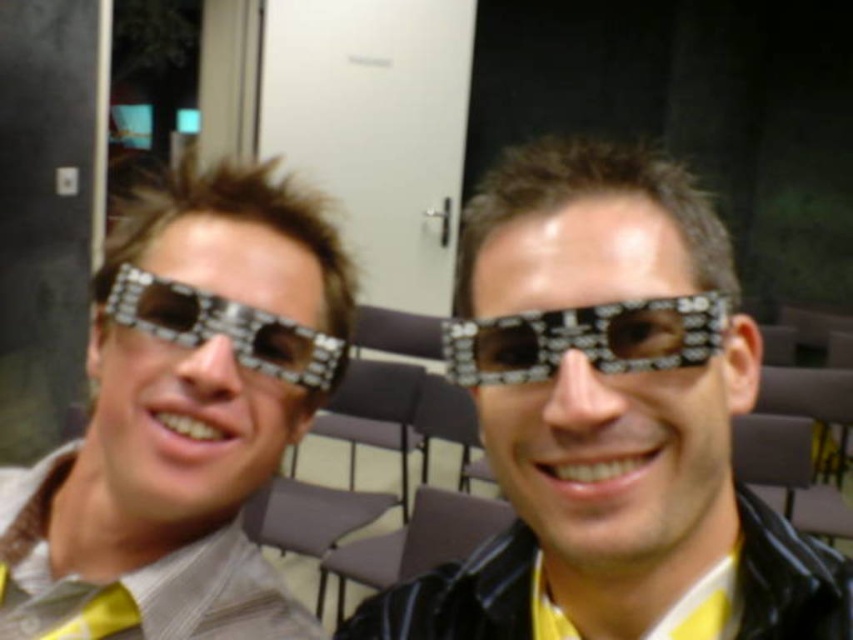
From the picture: You are organizing a photo shoot and need to decide which accessory to use for a closeup shot. Given the metallic reflective sunglasses at center and the yellow fabric tie at lower left, which one would be more suitable for a shot requiring a larger accessory?

The metallic reflective sunglasses at center has a larger size compared to the yellow fabric tie at lower left, making it more suitable for a closeup shot requiring a larger accessory.

You are standing in front of the two people wearing 3D glasses. You want to hand them the matte black sunglasses at center. Which person should you give it to?

The matte black sunglasses at center is located at point (x=608, y=413), so you should give it to the person on the right since they are closer to the sunglasses.

You are a photographer setting up for an event. You have a metallic reflective sunglasses at center and a yellow fabric tie at lower left in your frame. Which object should you adjust to avoid a reflection issue if the sunglasses are causing glare?

The metallic reflective sunglasses at center might be wider than the yellow fabric tie at lower left, so adjusting the sunglasses could help reduce the glare since they have a larger surface area.